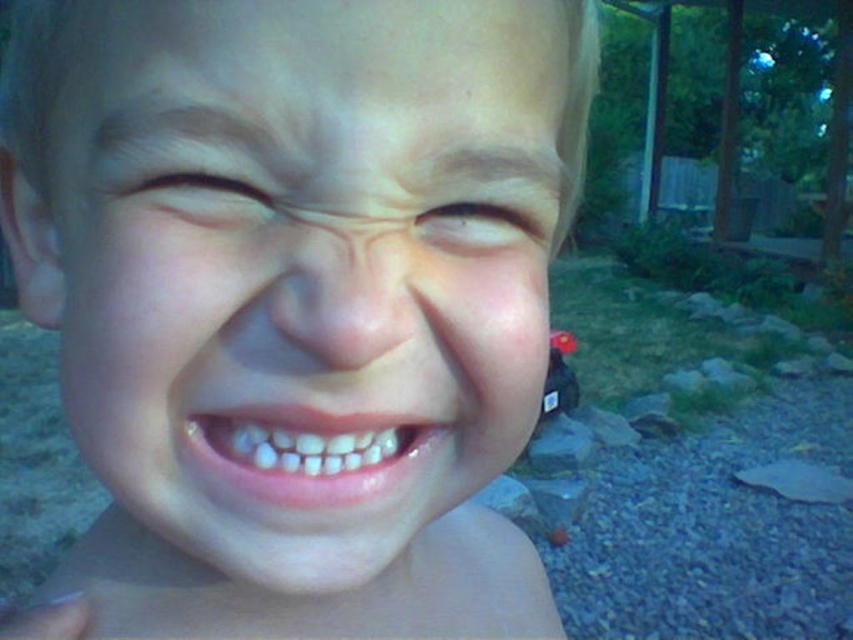
Between matte skin at upper left and brown matte eye at upper center, which one has less height?

Standing shorter between the two is matte skin at upper left.

Is matte skin at upper left above brown matte eye at upper center?

Yes, matte skin at upper left is above brown matte eye at upper center.

The width and height of the screenshot is (853, 640). I want to click on matte skin at upper left, so click(190, 193).

Is white glossy teeth at center positioned at the back of matte skin at upper left?

Yes.

Can you confirm if white glossy teeth at center is thinner than matte skin at upper left?

No.

Between point (289, 404) and point (247, 220), which one is positioned behind?

The point (247, 220) is more distant.

This screenshot has width=853, height=640. Identify the location of white glossy teeth at center. (311, 451).

Is smooth skin face at center shorter than white glossy teeth at center?

No.

Can you confirm if smooth skin face at center is positioned to the left of white glossy teeth at center?

Indeed, smooth skin face at center is positioned on the left side of white glossy teeth at center.

The image size is (853, 640). What do you see at coordinates (305, 269) in the screenshot?
I see `smooth skin face at center` at bounding box center [305, 269].

You are a GUI agent. You are given a task and a screenshot of the screen. Output one action in this format:
    pyautogui.click(x=<x>, y=<y>)
    Task: Click on the smooth skin face at center
    
    Given the screenshot: What is the action you would take?
    pyautogui.click(x=305, y=269)